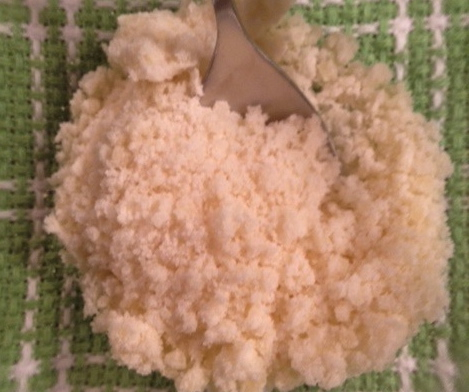
At what (x,y) coordinates should I click in order to perform the action: click on spoon. Please return your answer as a coordinate pair (x, y). This screenshot has height=392, width=469. Looking at the image, I should click on (272, 92).